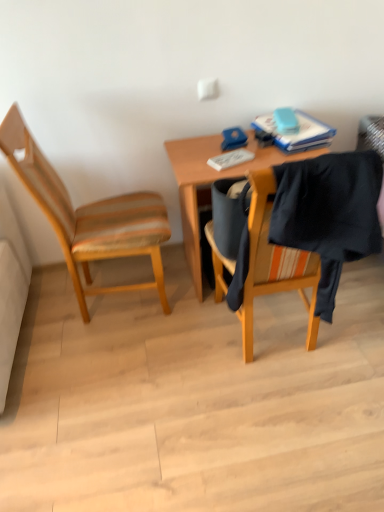
The image size is (384, 512). Find the location of `vacant space underneath wooden chair at left (from a real-world perspective)`. vacant space underneath wooden chair at left (from a real-world perspective) is located at coordinates (124, 303).